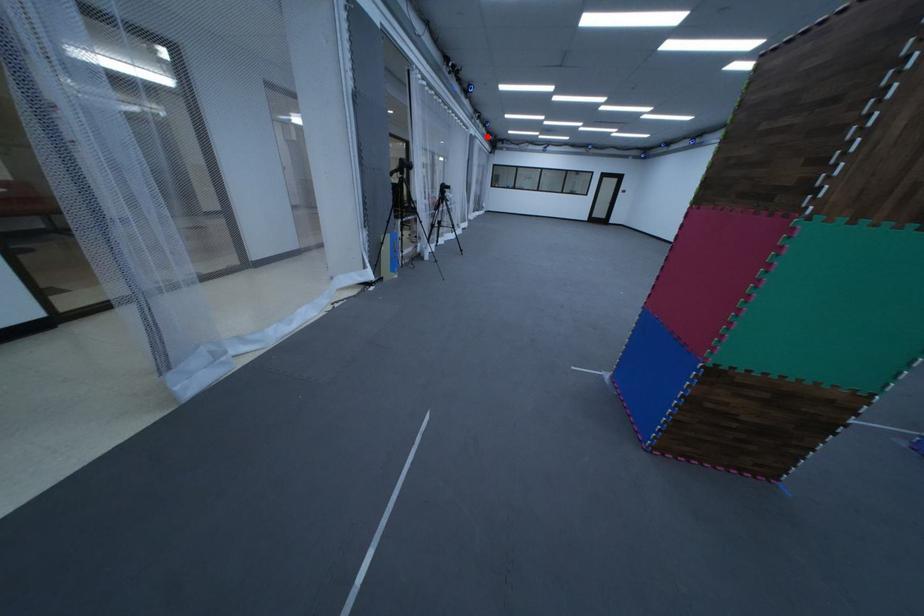
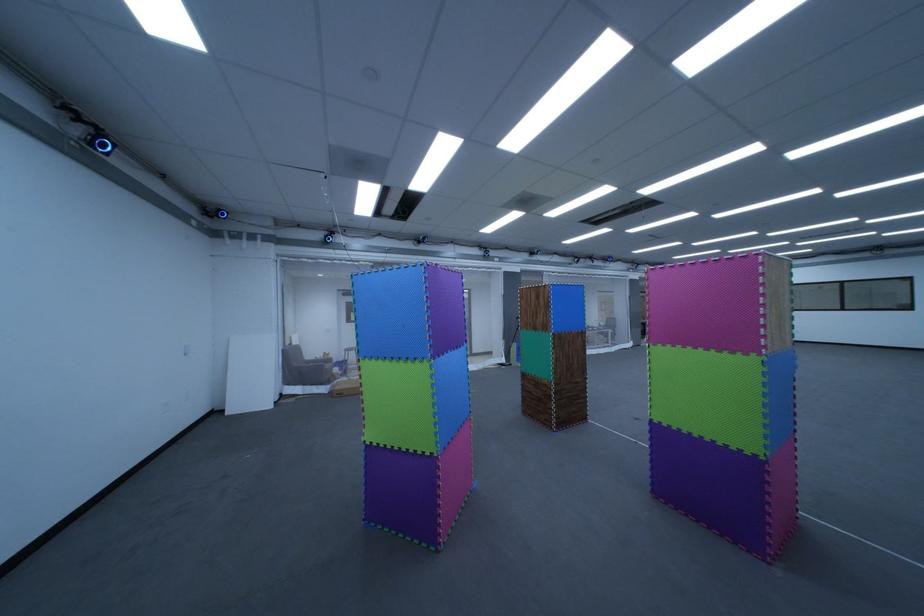
Where in the second image is the point corresponding to the highlighted location from the first image?

(647, 281)